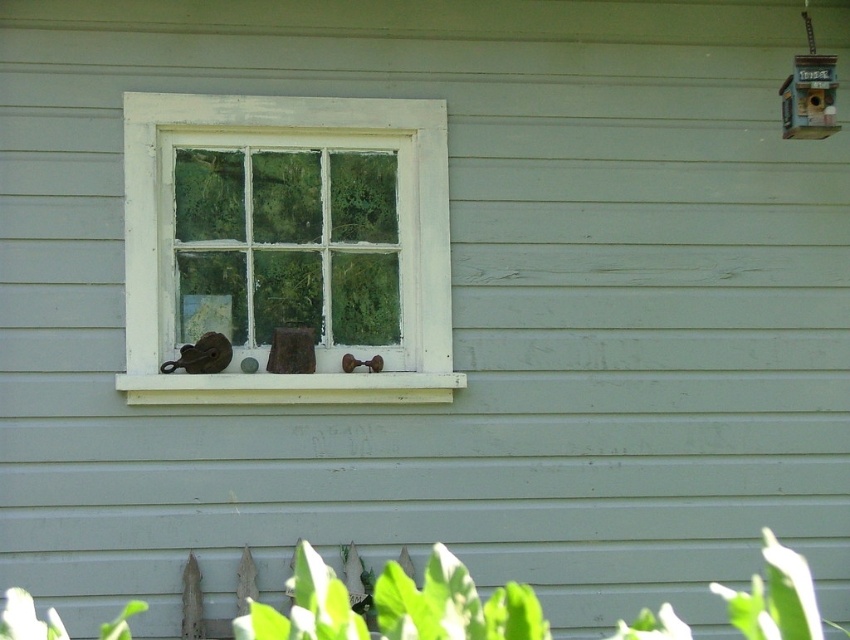
Question: Which point is closer to the camera?

Choices:
 (A) white painted wood at center
 (B) white painted wood window frame at center

Answer: (A)

Question: Among these objects, which one is farthest from the camera?

Choices:
 (A) white painted wood at center
 (B) white painted wood window frame at center

Answer: (B)

Question: Does white painted wood window frame at center have a smaller size compared to white painted wood at center?

Choices:
 (A) no
 (B) yes

Answer: (A)

Question: From the image, what is the correct spatial relationship of white painted wood window frame at center in relation to white painted wood at center?

Choices:
 (A) below
 (B) above

Answer: (B)

Question: Does white painted wood window frame at center have a smaller size compared to white painted wood at center?

Choices:
 (A) no
 (B) yes

Answer: (A)